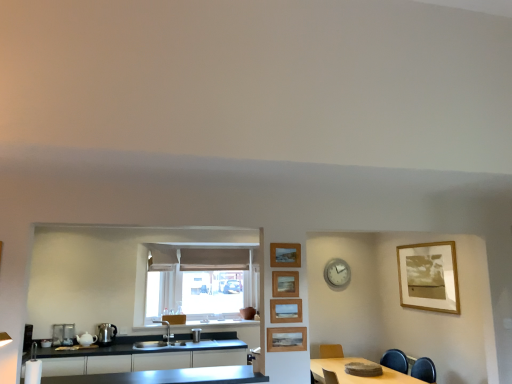
In order to face stainless steel countertop at lower center, should I rotate leftwards or rightwards?

You should rotate left by 13.899 degrees.

Describe the element at coordinates (168, 377) in the screenshot. I see `stainless steel countertop at lower center` at that location.

Describe the element at coordinates (285, 310) in the screenshot. I see `wooden picture frame at center, the fourth picture frame positioned from the back` at that location.

What do you see at coordinates (429, 277) in the screenshot? The width and height of the screenshot is (512, 384). I see `wooden framed photo at upper right, which is the 1th picture frame in right-to-left order` at bounding box center [429, 277].

In order to click on matte black cabinets at lower left in this screenshot , I will do `click(144, 356)`.

You are a GUI agent. You are given a task and a screenshot of the screen. Output one action in this format:
    pyautogui.click(x=<x>, y=<y>)
    Task: Click on the stainless steel countertop at lower center
    The height and width of the screenshot is (384, 512).
    Given the screenshot: What is the action you would take?
    pyautogui.click(x=168, y=377)

How many degrees apart are the facing directions of matte black cabinets at lower left and matte beige curtain at center?

They differ by 0.423 degrees in their facing directions.

Which of these two, matte black cabinets at lower left or matte beige curtain at center, stands taller?

Standing taller between the two is matte beige curtain at center.

In the image, there is a matte black cabinets at lower left. What are the coordinates of `window above it (from the image's perspective)` in the screenshot? It's located at (190, 291).

Choose the correct answer: Is matte black cabinets at lower left inside matte beige curtain at center or outside it?

matte black cabinets at lower left is located beyond the bounds of matte beige curtain at center.

From the image's perspective, is wooden picture frame at upper center, the first picture frame positioned from the left, positioned above or below wooden table at lower right?

Based on their image positions, wooden picture frame at upper center, the first picture frame positioned from the left, is located above wooden table at lower right.

Identify the location of picture frame that is the 5th one when counting upward from the wooden table at lower right (from the image's perspective). (285, 255).

Could you measure the distance between wooden picture frame at upper center, the second picture frame from the back, and wooden table at lower right?

wooden picture frame at upper center, the second picture frame from the back, and wooden table at lower right are 1.90 meters apart.

From the picture: From a real-world perspective, is wooden picture frame at upper center, the first picture frame positioned from the left, physically below wooden table at lower right?

Incorrect, from a real-world perspective, wooden picture frame at upper center, the first picture frame positioned from the left, is higher than wooden table at lower right.

Is shiny metallic kettle at lower left, the second appliance from the left, further to camera compared to matte black cabinets at lower left?

Yes, it is.

From the picture: From a real-world perspective, relative to matte black cabinets at lower left, is shiny metallic kettle at lower left, positioned as the 2th appliance in right-to-left order, vertically above or below?

shiny metallic kettle at lower left, positioned as the 2th appliance in right-to-left order, is situated higher than matte black cabinets at lower left in the real world.

Is shiny metallic kettle at lower left, the second appliance from the left, looking in the opposite direction of matte black cabinets at lower left?

No.

From the image's perspective, does shiny metallic kettle at lower left, positioned as the 2th appliance in right-to-left order, appear higher than matte black cabinets at lower left?

Yes, from the image's perspective, shiny metallic kettle at lower left, positioned as the 2th appliance in right-to-left order, is over matte black cabinets at lower left.

Who is bigger, satin silver faucet at center, the 3th appliance from the left, or wooden framed photo at upper right, which appears as the fifth picture frame when viewed from the left?

Bigger between the two is wooden framed photo at upper right, which appears as the fifth picture frame when viewed from the left.

Is satin silver faucet at center, the 3th appliance from the left, spatially inside wooden framed photo at upper right, placed as the 1th picture frame when sorted from back to front, or outside of it?

satin silver faucet at center, the 3th appliance from the left, is not enclosed by wooden framed photo at upper right, placed as the 1th picture frame when sorted from back to front.

Considering the sizes of satin silver faucet at center, the 3th appliance from the left, and wooden framed photo at upper right, which is the 1th picture frame in right-to-left order, in the image, is satin silver faucet at center, the 3th appliance from the left, wider or thinner than wooden framed photo at upper right, which is the 1th picture frame in right-to-left order,?

Clearly, satin silver faucet at center, the 3th appliance from the left, has more width compared to wooden framed photo at upper right, which is the 1th picture frame in right-to-left order.

How many degrees apart are the facing directions of satin silver faucet at center, the 3th appliance from the left, and wooden framed photo at upper right, which is the 1th picture frame in right-to-left order?

There is a 90.2-degree angle between the facing directions of satin silver faucet at center, the 3th appliance from the left, and wooden framed photo at upper right, which is the 1th picture frame in right-to-left order.

This screenshot has height=384, width=512. I want to click on clock lying on the right of stainless steel countertop at lower center, so click(337, 273).

Would you say white metallic clock at upper center is inside or outside stainless steel countertop at lower center?

white metallic clock at upper center is spatially situated outside stainless steel countertop at lower center.

Is white metallic clock at upper center facing towards stainless steel countertop at lower center?

No, white metallic clock at upper center is not aimed at stainless steel countertop at lower center.

From a real-world perspective, is white metallic clock at upper center physically above stainless steel countertop at lower center?

Yes, from a real-world perspective, white metallic clock at upper center is on top of stainless steel countertop at lower center.

Where is `the 1st appliance to the left when counting from the white metallic clock at upper center`? Image resolution: width=512 pixels, height=384 pixels. the 1st appliance to the left when counting from the white metallic clock at upper center is located at coordinates (196, 335).

Does point (335, 280) lie in front of point (199, 330)?

Yes, it is.

From a real-world perspective, which is physically above, white metallic clock at upper center or satin silver faucet at center, the 1th appliance in the right-to-left sequence?

white metallic clock at upper center, from a real-world perspective.

Between white metallic clock at upper center and satin silver faucet at center, the 3th appliance from the left, which one is positioned in front?

Positioned in front is satin silver faucet at center, the 3th appliance from the left.

Considering the relative sizes of stainless steel countertop at lower center and wooden picture frame at upper center, the 3th picture frame viewed from the front, in the image provided, is stainless steel countertop at lower center thinner than wooden picture frame at upper center, the 3th picture frame viewed from the front,?

No, stainless steel countertop at lower center is not thinner than wooden picture frame at upper center, the 3th picture frame viewed from the front.

Between stainless steel countertop at lower center and wooden picture frame at upper center, positioned as the third picture frame in left-to-right order, which one has smaller size?

With smaller size is wooden picture frame at upper center, positioned as the third picture frame in left-to-right order.

Could wooden picture frame at upper center, arranged as the 3th picture frame when viewed from the back, be considered to be inside stainless steel countertop at lower center?

No, wooden picture frame at upper center, arranged as the 3th picture frame when viewed from the back, is located outside of stainless steel countertop at lower center.

In the scene shown: Is wooden picture frame at upper center, the 3th picture frame viewed from the front, at the back of stainless steel countertop at lower center?

That's not correct — stainless steel countertop at lower center is not looking away from wooden picture frame at upper center, the 3th picture frame viewed from the front.

Locate an element on the screen. window behind the matte black cabinets at lower left is located at coordinates (190, 291).

Find the location of `the 5th picture frame positioned above the wooden table at lower right (from a real-world perspective)`. the 5th picture frame positioned above the wooden table at lower right (from a real-world perspective) is located at coordinates (285, 255).

Considering their positions, is stainless steel countertop at lower center positioned further to matte black cabinets at lower left than white metallic clock at upper center?

Based on the image, white metallic clock at upper center appears to be further to matte black cabinets at lower left.

Estimate the real-world distances between objects in this image. Which object is further from wooden table at lower right, shiny metallic kettle at lower left, positioned as the 2th appliance in right-to-left order, or wooden picture frame at upper center, the first picture frame positioned from the left?

shiny metallic kettle at lower left, positioned as the 2th appliance in right-to-left order.

Which object lies further to the anchor point stainless steel countertop at lower center, white metallic clock at upper center or wooden table at lower right?

white metallic clock at upper center is positioned further to the anchor stainless steel countertop at lower center.

When comparing their distances from matte beige curtain at center, does white metallic clock at upper center or satin silver faucet at center, the 3th appliance from the left, seem further?

Among the two, white metallic clock at upper center is located further to matte beige curtain at center.

Based on their spatial positions, is metallic silver toaster at lower left, the first appliance positioned from the left, or wooden framed photo at upper right, which appears as the fifth picture frame when viewed from the left, closer to white metallic clock at upper center?

The object closer to white metallic clock at upper center is wooden framed photo at upper right, which appears as the fifth picture frame when viewed from the left.

Looking at the image, which one is located closer to wooden picture frame at upper center, arranged as the 3th picture frame when viewed from the back, white metallic clock at upper center or wooden picture frame at upper center, which is counted as the fourth picture frame, starting from the front?

wooden picture frame at upper center, which is counted as the fourth picture frame, starting from the front.

Which object lies further to the anchor point stainless steel countertop at lower center, wooden table at lower right or wooden picture frame at center, the 4th picture frame positioned from the left?

wooden picture frame at center, the 4th picture frame positioned from the left, is positioned further to the anchor stainless steel countertop at lower center.

Which object lies nearer to the anchor point wooden picture frame at center, which is the second picture frame in left-to-right order, satin silver faucet at center, the 3th appliance from the left, or wooden picture frame at upper center, positioned as the third picture frame in left-to-right order?

The object closer to wooden picture frame at center, which is the second picture frame in left-to-right order, is wooden picture frame at upper center, positioned as the third picture frame in left-to-right order.

In order to click on table between wooden picture frame at upper center, the 3th picture frame viewed from the front, and matte beige curtain at center in the front-back direction in this screenshot , I will do `click(358, 376)`.

At what (x,y) coordinates should I click in order to perform the action: click on table between wooden picture frame at upper center, the second picture frame from the back, and white metallic clock at upper center in the front-back direction. Please return your answer as a coordinate pair (x, y). This screenshot has width=512, height=384. Looking at the image, I should click on coord(358,376).

Locate an element on the screen. The width and height of the screenshot is (512, 384). cabinetry between metallic silver toaster at lower left, the first appliance positioned from the left, and white metallic clock at upper center from left to right is located at coordinates (144, 356).

Where is `table between wooden picture frame at upper center, arranged as the 3th picture frame when viewed from the back, and white metallic clock at upper center from front to back`? This screenshot has width=512, height=384. table between wooden picture frame at upper center, arranged as the 3th picture frame when viewed from the back, and white metallic clock at upper center from front to back is located at coordinates (358, 376).